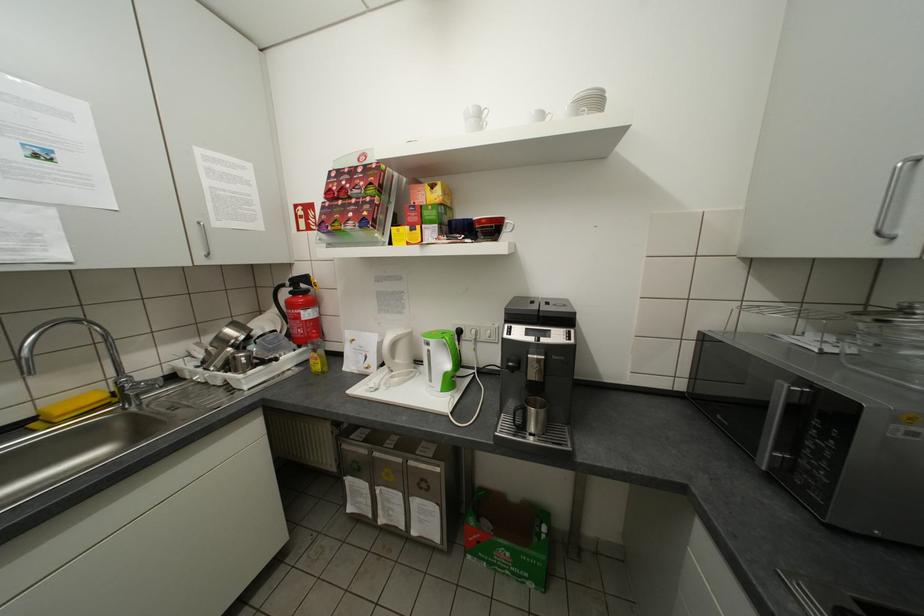
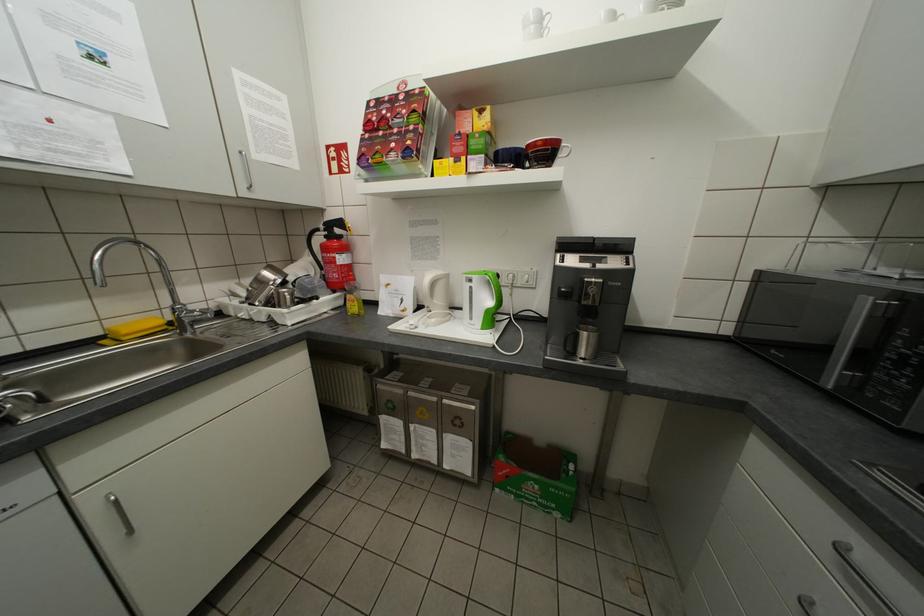
Where in the second image is the point corresponding to pixel 452 338 from the first image?

(494, 274)